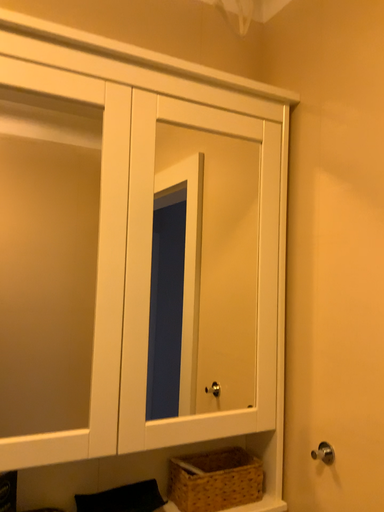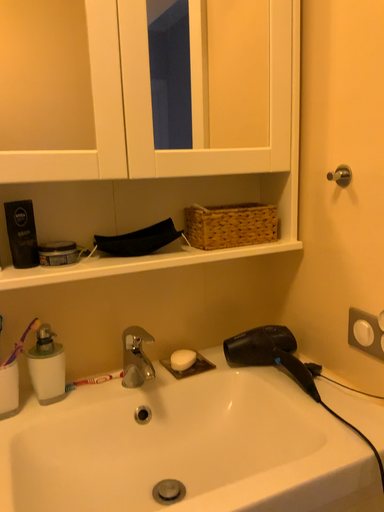
Question: Which way did the camera rotate in the video?

Choices:
 (A) rotated downward
 (B) rotated upward

Answer: (A)